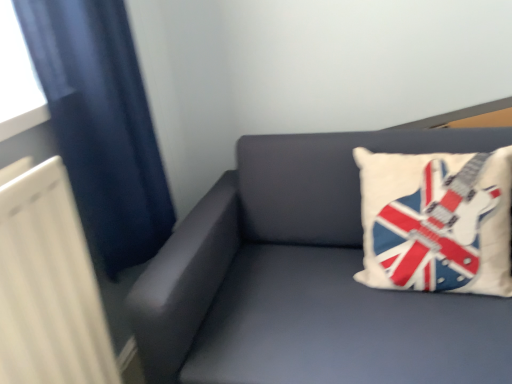
The width and height of the screenshot is (512, 384). Describe the element at coordinates (307, 279) in the screenshot. I see `matte gray couch at upper right` at that location.

Locate an element on the screen. This screenshot has height=384, width=512. matte gray couch at upper right is located at coordinates (307, 279).

This screenshot has height=384, width=512. Find the location of `white fabric pillow with guitar design at upper right`. white fabric pillow with guitar design at upper right is located at coordinates (436, 221).

Is dark blue fabric at left not within white fabric pillow with guitar design at upper right?

Absolutely, dark blue fabric at left is external to white fabric pillow with guitar design at upper right.

Is dark blue fabric at left touching white fabric pillow with guitar design at upper right?

No, dark blue fabric at left is not touching white fabric pillow with guitar design at upper right.

Which of these two, dark blue fabric at left or white fabric pillow with guitar design at upper right, stands shorter?

white fabric pillow with guitar design at upper right.

How far apart are dark blue fabric at left and white fabric pillow with guitar design at upper right?

dark blue fabric at left is 27.89 inches away from white fabric pillow with guitar design at upper right.

Is dark blue fabric at left not within matte gray couch at upper right?

Yes, dark blue fabric at left is outside of matte gray couch at upper right.

Is dark blue fabric at left facing towards matte gray couch at upper right?

Yes, dark blue fabric at left is oriented towards matte gray couch at upper right.

You are a GUI agent. You are given a task and a screenshot of the screen. Output one action in this format:
    pyautogui.click(x=<x>, y=<y>)
    Task: Click on the studio couch in front of the dark blue fabric at left
    This screenshot has height=384, width=512.
    Given the screenshot: What is the action you would take?
    pyautogui.click(x=307, y=279)

How different are the orientations of dark blue fabric at left and matte gray couch at upper right in degrees?

90.7 degrees.

Based on their positions, is matte gray couch at upper right located to the left or right of white fabric pillow with guitar design at upper right?

matte gray couch at upper right is positioned on white fabric pillow with guitar design at upper right's left side.

Considering the sizes of matte gray couch at upper right and white fabric pillow with guitar design at upper right in the image, is matte gray couch at upper right bigger or smaller than white fabric pillow with guitar design at upper right?

matte gray couch at upper right is bigger than white fabric pillow with guitar design at upper right.

Relative to white fabric pillow with guitar design at upper right, is matte gray couch at upper right in front or behind?

Clearly, matte gray couch at upper right is in front of white fabric pillow with guitar design at upper right.

Do you think white fabric pillow with guitar design at upper right is within matte gray couch at upper right, or outside of it?

white fabric pillow with guitar design at upper right is enclosed within matte gray couch at upper right.

Based on their sizes in the image, would you say white fabric pillow with guitar design at upper right is bigger or smaller than matte gray couch at upper right?

Considering their sizes, white fabric pillow with guitar design at upper right takes up less space than matte gray couch at upper right.

Are white fabric pillow with guitar design at upper right and matte gray couch at upper right beside each other?

They are not placed beside each other.

Find the location of `studio couch below the white fabric pillow with guitar design at upper right (from a real-world perspective)`. studio couch below the white fabric pillow with guitar design at upper right (from a real-world perspective) is located at coordinates (307, 279).

Locate an element on the screen. This screenshot has height=384, width=512. curtain in front of the white fabric pillow with guitar design at upper right is located at coordinates (101, 124).

Can you confirm if white fabric pillow with guitar design at upper right is bigger than dark blue fabric at left?

No.

Which object is wider, white fabric pillow with guitar design at upper right or dark blue fabric at left?

white fabric pillow with guitar design at upper right is wider.

Based on the photo, from the image's perspective, who appears lower, white fabric pillow with guitar design at upper right or dark blue fabric at left?

white fabric pillow with guitar design at upper right.

Can you tell me how much matte gray couch at upper right and dark blue fabric at left differ in facing direction?

The angle between the facing direction of matte gray couch at upper right and the facing direction of dark blue fabric at left is 90.7 degrees.

Is matte gray couch at upper right directly adjacent to dark blue fabric at left?

They are not placed beside each other.

Is matte gray couch at upper right in front of or behind dark blue fabric at left in the image?

matte gray couch at upper right is positioned closer to the viewer than dark blue fabric at left.

Which of these two, matte gray couch at upper right or dark blue fabric at left, is bigger?

matte gray couch at upper right.

You are a GUI agent. You are given a task and a screenshot of the screen. Output one action in this format:
    pyautogui.click(x=<x>, y=<y>)
    Task: Click on the pillow that appears below the dark blue fabric at left (from a real-world perspective)
    
    Given the screenshot: What is the action you would take?
    pyautogui.click(x=436, y=221)

Identify the location of curtain on the left of matte gray couch at upper right. [x=101, y=124].

From the image, which object appears to be nearer to dark blue fabric at left, matte gray couch at upper right or white fabric pillow with guitar design at upper right?

Based on the image, matte gray couch at upper right appears to be nearer to dark blue fabric at left.

Based on their spatial positions, is matte gray couch at upper right or dark blue fabric at left closer to white fabric pillow with guitar design at upper right?

matte gray couch at upper right.

Based on the photo, considering their positions, is dark blue fabric at left positioned further to white fabric pillow with guitar design at upper right than matte gray couch at upper right?

dark blue fabric at left is further to white fabric pillow with guitar design at upper right.

When comparing their distances from dark blue fabric at left, does white fabric pillow with guitar design at upper right or matte gray couch at upper right seem further?

white fabric pillow with guitar design at upper right lies further to dark blue fabric at left than the other object.

In the scene shown: Estimate the real-world distances between objects in this image. Which object is closer to matte gray couch at upper right, dark blue fabric at left or white fabric pillow with guitar design at upper right?

white fabric pillow with guitar design at upper right is positioned closer to the anchor matte gray couch at upper right.

Based on their spatial positions, is white fabric pillow with guitar design at upper right or dark blue fabric at left closer to matte gray couch at upper right?

The object closer to matte gray couch at upper right is white fabric pillow with guitar design at upper right.

Where is `studio couch between dark blue fabric at left and white fabric pillow with guitar design at upper right`? The height and width of the screenshot is (384, 512). studio couch between dark blue fabric at left and white fabric pillow with guitar design at upper right is located at coordinates (307, 279).